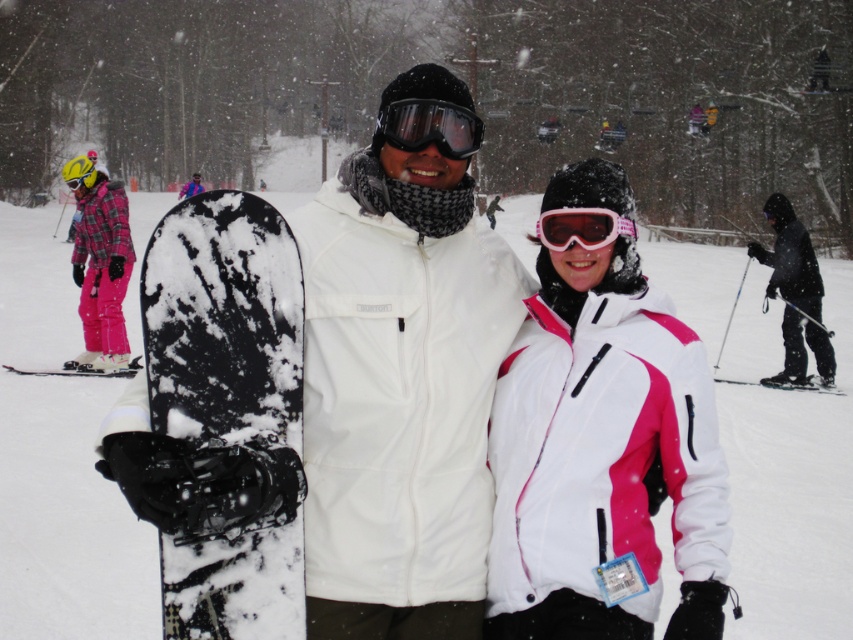
Question: Which is farther from the black metallic ski at lower left?

Choices:
 (A) pink matte goggles at center
 (B) white/pink fabric jacket at center

Answer: (B)

Question: Based on their relative distances, which object is farther from the plaid fabric snowsuit at left?

Choices:
 (A) black matte ski suit at right
 (B) white matte snowboard at center

Answer: (B)

Question: Can you confirm if plaid fabric snowsuit at left is bigger than black matte ski at lower right?

Choices:
 (A) no
 (B) yes

Answer: (A)

Question: Is white/pink fabric jacket at center further to camera compared to snowy matte snowboard at center?

Choices:
 (A) yes
 (B) no

Answer: (A)

Question: Which of the following is the farthest from the observer?

Choices:
 (A) black matte goggles at center
 (B) snowy matte snowboard at center
 (C) black matte ski suit at right

Answer: (C)

Question: Does snowy matte snowboard at center have a greater width compared to black metallic ski at lower left?

Choices:
 (A) no
 (B) yes

Answer: (A)